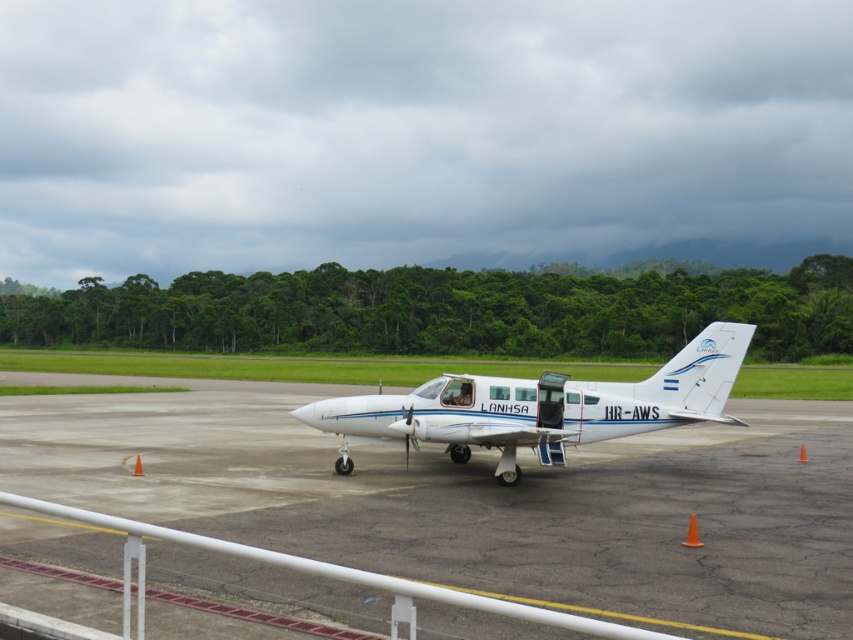
Does white smooth tarmac at center have a greater height compared to white glossy airplane at center?

Yes, white smooth tarmac at center is taller than white glossy airplane at center.

This screenshot has width=853, height=640. Describe the element at coordinates (479, 500) in the screenshot. I see `white smooth tarmac at center` at that location.

Is point (595, 481) positioned in front of point (532, 388)?

Yes.

This screenshot has width=853, height=640. What are the coordinates of `white smooth tarmac at center` in the screenshot? It's located at (479, 500).